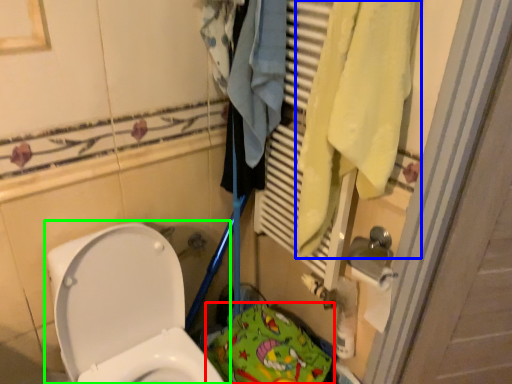
Question: Considering the real-world distances, which object is farthest from material (highlighted by a red box)? bath towel (highlighted by a blue box) or toilet (highlighted by a green box)?

Choices:
 (A) bath towel
 (B) toilet

Answer: (A)